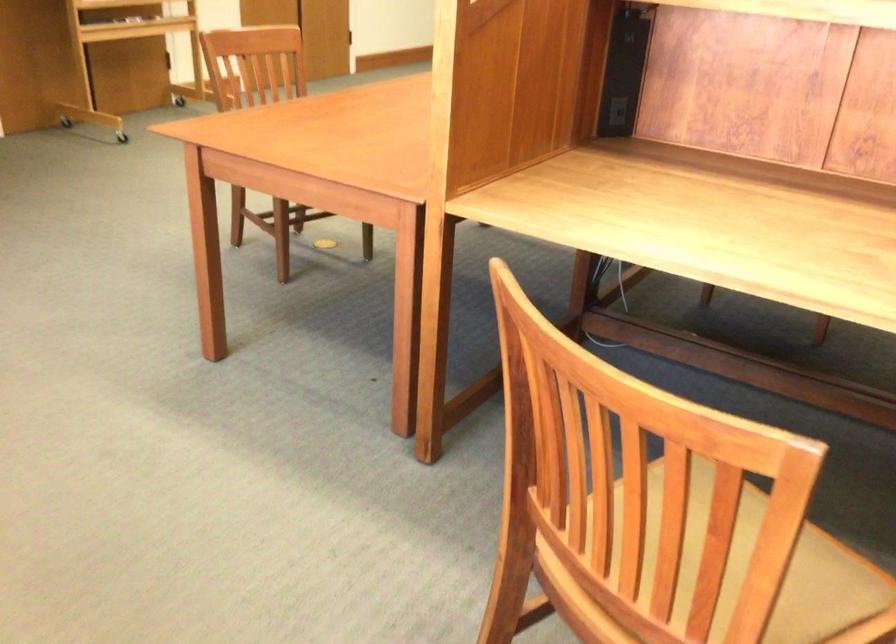
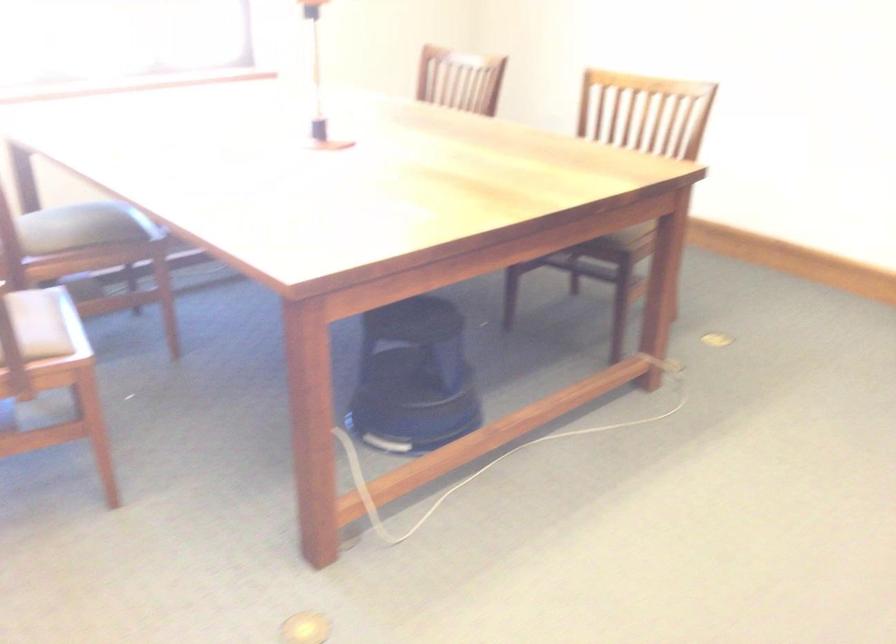
How did the camera likely rotate?

The camera's rotation is toward left-down.